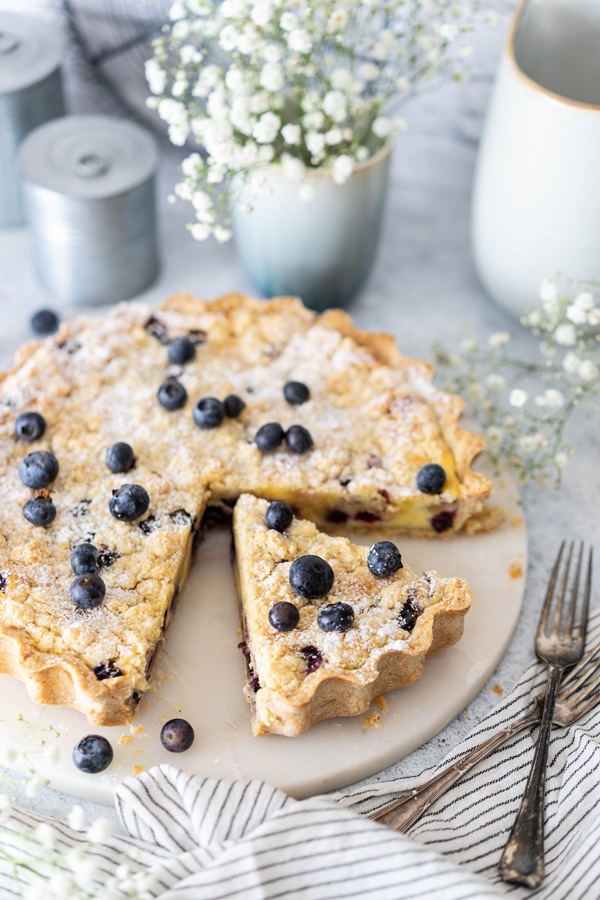
Image resolution: width=600 pixels, height=900 pixels. I want to click on white flower bunch in vase, so click(x=287, y=76).